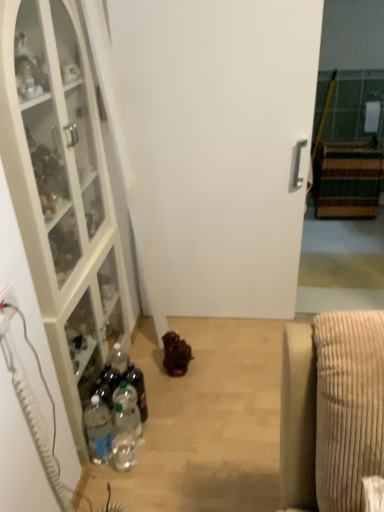
Question: Considering the relative positions of striped carpet at right, positioned as the 2th cabinetry in front-to-back order, and clear plastic bottle at lower left, which is the 3th bottle from right to left, in the image provided, is striped carpet at right, positioned as the 2th cabinetry in front-to-back order, to the left of clear plastic bottle at lower left, which is the 3th bottle from right to left, from the viewer's perspective?

Choices:
 (A) no
 (B) yes

Answer: (A)

Question: From a real-world perspective, is striped carpet at right, positioned as the 2th cabinetry in front-to-back order, positioned under clear plastic bottle at lower left, which is the 1th bottle in left-to-right order, based on gravity?

Choices:
 (A) no
 (B) yes

Answer: (A)

Question: Is the position of striped carpet at right, which ranks as the 2th cabinetry in left-to-right order, less distant than that of clear plastic bottle at lower left, which is the 3th bottle from right to left?

Choices:
 (A) no
 (B) yes

Answer: (A)

Question: Can you see striped carpet at right, which ranks as the 1th cabinetry in right-to-left order, touching clear plastic bottle at lower left, which is the 3th bottle from right to left?

Choices:
 (A) no
 (B) yes

Answer: (A)

Question: Can we say striped carpet at right, which ranks as the 1th cabinetry in right-to-left order, lies outside clear plastic bottle at lower left, which is the 1th bottle in left-to-right order?

Choices:
 (A) no
 (B) yes

Answer: (B)

Question: From a real-world perspective, is striped carpet at right, positioned as the 2th cabinetry in front-to-back order, physically above clear plastic bottle at lower left, which is the 1th bottle in left-to-right order?

Choices:
 (A) no
 (B) yes

Answer: (B)

Question: Is white plastic electric outlet at lower left located outside clear plastic bottle at lower left, which is the 1th bottle in left-to-right order?

Choices:
 (A) yes
 (B) no

Answer: (A)

Question: From a real-world perspective, is white plastic electric outlet at lower left physically above clear plastic bottle at lower left, which is the 3th bottle from right to left?

Choices:
 (A) no
 (B) yes

Answer: (B)

Question: Can you confirm if white plastic electric outlet at lower left is positioned to the right of clear plastic bottle at lower left, which is the 1th bottle in left-to-right order?

Choices:
 (A) no
 (B) yes

Answer: (A)

Question: Is white plastic electric outlet at lower left smaller than clear plastic bottle at lower left, which is the 3th bottle from right to left?

Choices:
 (A) no
 (B) yes

Answer: (B)

Question: Are white plastic electric outlet at lower left and clear plastic bottle at lower left, which is the 3th bottle from right to left, making contact?

Choices:
 (A) no
 (B) yes

Answer: (A)

Question: Is the position of white plastic electric outlet at lower left less distant than that of clear plastic bottle at lower left, which is the 3th bottle from right to left?

Choices:
 (A) no
 (B) yes

Answer: (B)

Question: From a real-world perspective, is white matte door at center physically above white plastic electric outlet at lower left?

Choices:
 (A) no
 (B) yes

Answer: (A)